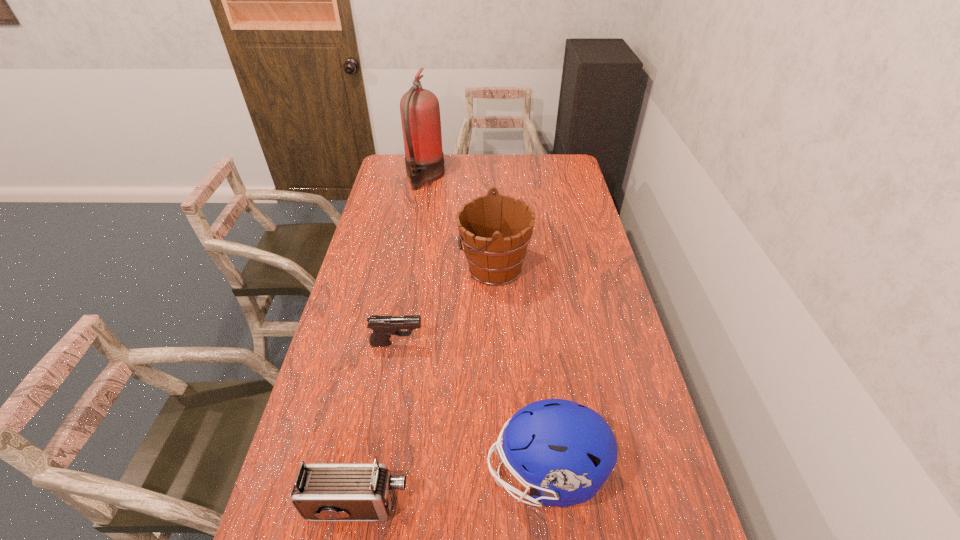
Where is `the tallest object`? This screenshot has width=960, height=540. the tallest object is located at coordinates (420, 113).

The height and width of the screenshot is (540, 960). I want to click on fire extinguisher, so click(x=420, y=113).

Identify the location of the fourth nearest object. tap(495, 230).

At what (x,y) coordinates should I click in order to perform the action: click on football helmet. Please return your answer as a coordinate pair (x, y). Looking at the image, I should click on (566, 451).

At what (x,y) coordinates should I click in order to perform the action: click on the second shortest object. Please return your answer as a coordinate pair (x, y). Looking at the image, I should click on (322, 491).

Locate an element on the screen. pistol is located at coordinates (383, 327).

This screenshot has width=960, height=540. Identify the location of the third farthest object. (383, 327).

At what (x,y) coordinates should I click in order to perform the action: click on blank area located at the nozzle of the tallest object. Please return your answer as a coordinate pair (x, y). The image size is (960, 540). Looking at the image, I should click on (492, 177).

The image size is (960, 540). Find the location of `vacant point located with the handle on the second farthest object`. vacant point located with the handle on the second farthest object is located at coordinates (439, 267).

You are a GUI agent. You are given a task and a screenshot of the screen. Output one action in this format:
    pyautogui.click(x=<x>, y=<y>)
    Task: Click on the vacant space located with the handle on the second farthest object
    The image size is (960, 540).
    Given the screenshot: What is the action you would take?
    pyautogui.click(x=397, y=267)